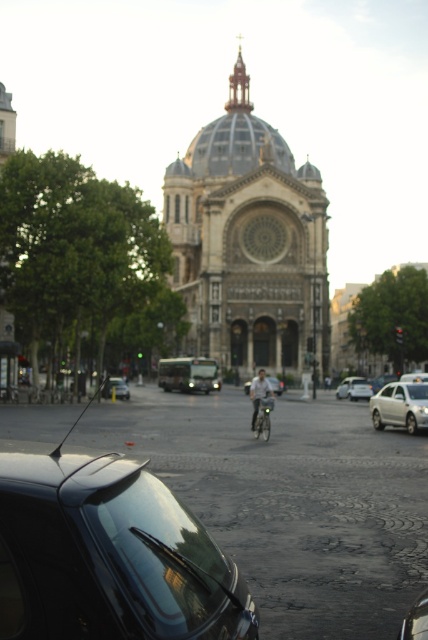
Does light gray fabric bicycle at center have a smaller size compared to silver metallic sedan at center?

No.

Image resolution: width=428 pixels, height=640 pixels. What do you see at coordinates (261, 400) in the screenshot?
I see `light gray fabric bicycle at center` at bounding box center [261, 400].

What do you see at coordinates (261, 400) in the screenshot?
I see `light gray fabric bicycle at center` at bounding box center [261, 400].

Where is `light gray fabric bicycle at center`? The image size is (428, 640). light gray fabric bicycle at center is located at coordinates (261, 400).

Is light gray fabric bicycle at center taller than shiny black car at lower right?

Correct, light gray fabric bicycle at center is much taller as shiny black car at lower right.

Is light gray fabric bicycle at center to the right of shiny black car at lower right from the viewer's perspective?

Incorrect, light gray fabric bicycle at center is not on the right side of shiny black car at lower right.

The image size is (428, 640). Identify the location of light gray fabric bicycle at center. (261, 400).

Between point (15, 497) and point (264, 429), which one is positioned behind?

The point (264, 429) is more distant.

Does point (24, 532) come closer to viewer compared to point (264, 428)?

That is True.

The width and height of the screenshot is (428, 640). In order to click on shiny black car at center in this screenshot , I will do `click(109, 554)`.

Where is `shiny black car at center`? shiny black car at center is located at coordinates (x=109, y=554).